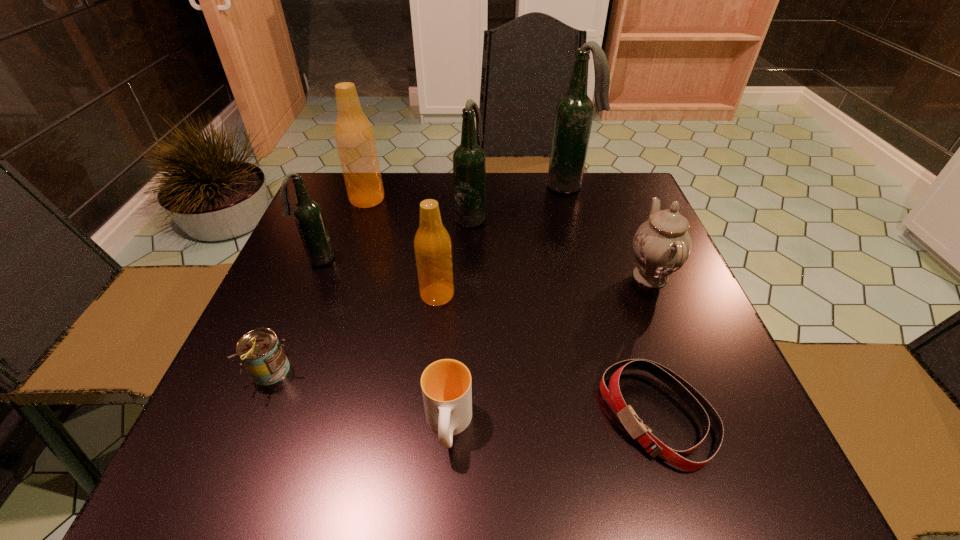
Where is `vacant space located on the right of the smaller tan beer bottle`? Image resolution: width=960 pixels, height=540 pixels. vacant space located on the right of the smaller tan beer bottle is located at coordinates point(632,295).

This screenshot has height=540, width=960. I want to click on free space located on the spout of the chinaware, so click(x=564, y=276).

Where is `free space located on the spout of the chinaware`? Image resolution: width=960 pixels, height=540 pixels. free space located on the spout of the chinaware is located at coordinates (492, 276).

At what (x,y) coordinates should I click in order to perform the action: click on vacant area located on the spout of the chinaware. Please return your answer as a coordinate pair (x, y). This screenshot has width=960, height=540. Looking at the image, I should click on (445, 276).

Identify the location of free space located on the right of the can. (405, 372).

Image resolution: width=960 pixels, height=540 pixels. Identify the location of free space located on the left of the pink dog collar. (482, 417).

I want to click on cup that is positioned at the near edge, so click(x=446, y=386).

At what (x,y) coordinates should I click in order to perform the action: click on dog collar positioned at the near edge. Please return your answer as a coordinate pair (x, y). Image resolution: width=960 pixels, height=540 pixels. Looking at the image, I should click on (706, 414).

Locate an element on the screen. The height and width of the screenshot is (540, 960). can that is at the left edge is located at coordinates (261, 352).

You are a GUI agent. You are given a task and a screenshot of the screen. Output one action in this format:
    pyautogui.click(x=<x>, y=<y>)
    Task: Click on the beer bottle located at the right edge
    The height and width of the screenshot is (540, 960).
    Given the screenshot: What is the action you would take?
    pyautogui.click(x=574, y=112)